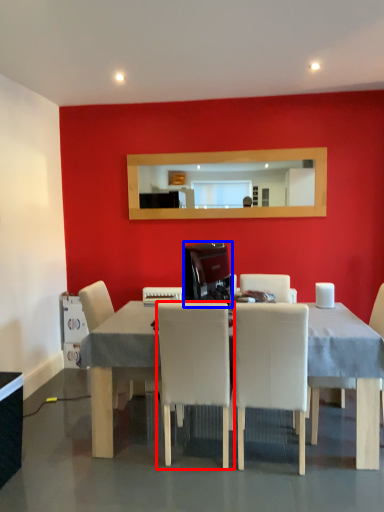
Question: Which of the following is the closest to the observer, chair (highlighted by a red box) or appliance (highlighted by a blue box)?

Choices:
 (A) chair
 (B) appliance

Answer: (A)